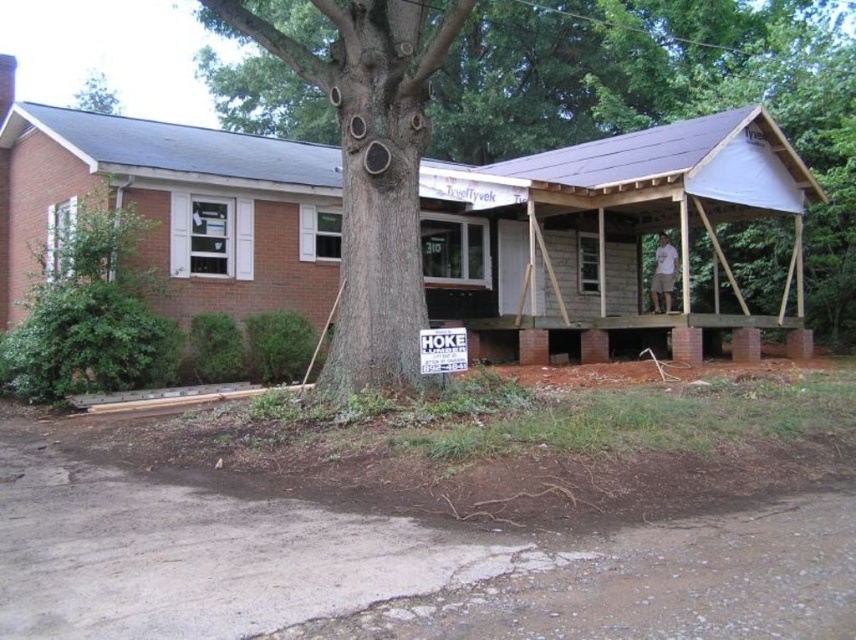
Can you confirm if brown rough bark tree at center is wider than green rough bark tree at upper center?

Yes.

Where is `brown rough bark tree at center`? brown rough bark tree at center is located at coordinates (629, 234).

Does brown rough bark tree at center appear over brick/wooden porch at center?

Yes, brown rough bark tree at center is above brick/wooden porch at center.

Locate an element on the screen. The width and height of the screenshot is (856, 640). brown rough bark tree at center is located at coordinates (629, 234).

Measure the distance between brick/wooden porch at center and camera.

The distance of brick/wooden porch at center from camera is 14.28 meters.

Is point (734, 339) farther from camera compared to point (94, 84)?

No, (734, 339) is closer to viewer.

Which is in front, point (786, 317) or point (110, 113)?

Point (786, 317) is in front.

Identify the location of brick/wooden porch at center. (626, 337).